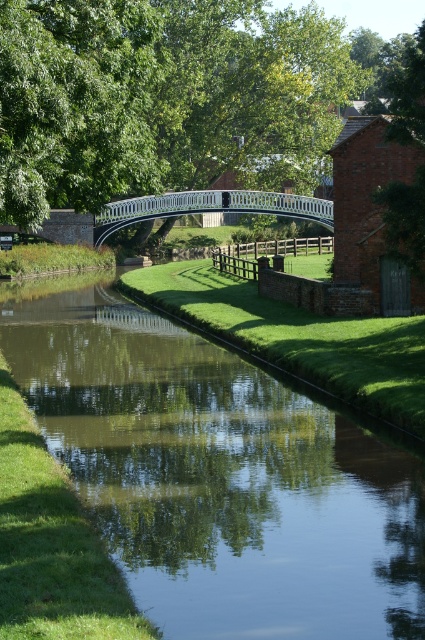
You are standing on the green grassy bank at center and want to cross to the other side of the canal. The white glossy bridge at center is your only path. Since you can see the bridge, can you confirm if it is reachable from your current position?

Yes, the green grassy bank at center is closer to the viewer than the white glossy bridge at center, so the bridge is reachable from your current position on the green grassy bank at center.

You are standing on the wooden fence near the canal and want to cross to the other side. The white glossy bridge at center is in your path. Can you walk directly to the green grassy bank at center without stepping on the bridge?

The green grassy bank at center is located below the white glossy bridge at center, so you can walk directly to the green grassy bank at center by going under the bridge.